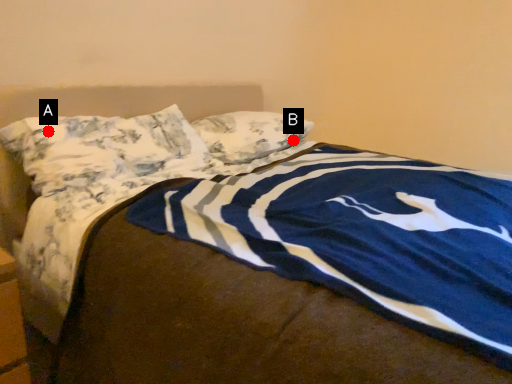
Question: Two points are circled on the image, labeled by A and B beside each circle. Which point appears farthest from the camera in this image?

Choices:
 (A) A is further
 (B) B is further

Answer: (B)